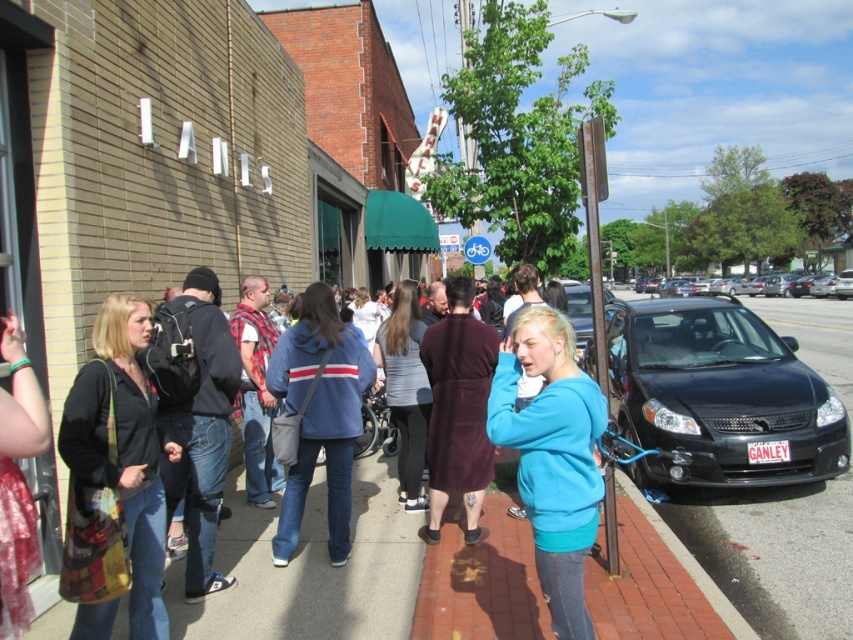
You are a photographer trying to capture both the blue cotton hoodie at center and the gray fabric jacket at center in a single frame. Since you want to emphasize the smaller item, which clothing item should you focus on to ensure it stands out more?

The blue cotton hoodie at center is smaller than the gray fabric jacket at center, so focusing on the blue cotton hoodie at center will help it stand out more in the photo.

Looking at this image, you are a person standing on the sidewalk in the image. You want to pick up the blue cotton hoodie at center and the gray fabric jacket at center. Which one do you need to move first to reach the other?

A: The blue cotton hoodie at center is in front of the gray fabric jacket at center, so you need to move the blue cotton hoodie at center first to reach the gray fabric jacket at center.

You are standing at the center of the sidewalk in the street scene. You want to place a new bench exactly at the point where the blue fleece jacket at center is currently located. Is this possible?

Yes, since the blue fleece jacket at center is located at point (552,456), you can place the bench there as long as the space is unoccupied.